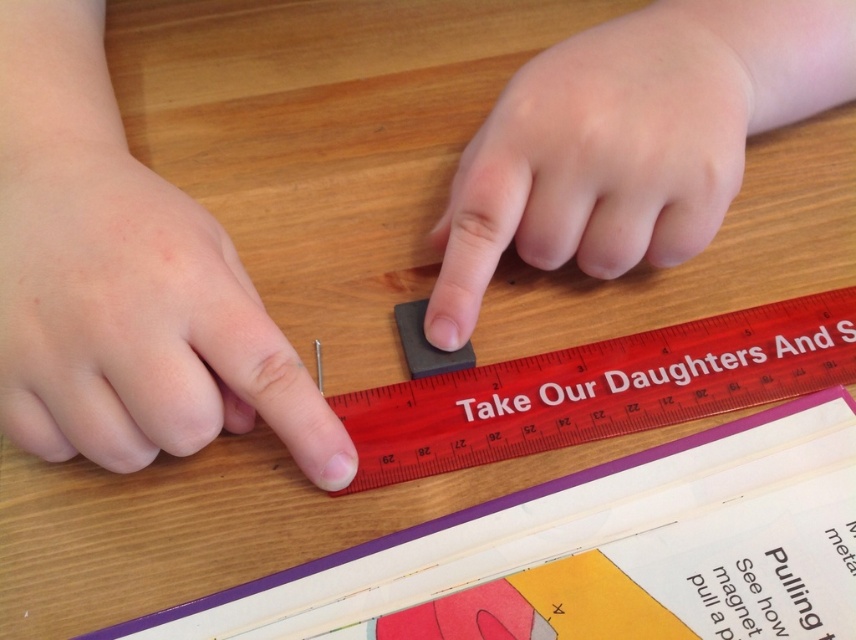
Question: Which object appears farthest from the camera in this image?

Choices:
 (A) smooth skin hand at center
 (B) black rubber ruler at center

Answer: (B)

Question: Is smooth skin hand at center further to the viewer compared to black rubber ruler at center?

Choices:
 (A) no
 (B) yes

Answer: (A)

Question: Can you confirm if smooth skin finger at center is smaller than black rubber ruler at center?

Choices:
 (A) no
 (B) yes

Answer: (A)

Question: Which point is closer to the camera taking this photo?

Choices:
 (A) (189, 305)
 (B) (792, 307)
 (C) (450, 368)

Answer: (A)

Question: Estimate the real-world distances between objects in this image. Which object is closer to the smooth skin hand at center?

Choices:
 (A) red plastic ruler at center
 (B) smooth skin finger at center

Answer: (A)

Question: Can you confirm if smooth skin hand at center is positioned to the left of black rubber ruler at center?

Choices:
 (A) yes
 (B) no

Answer: (B)